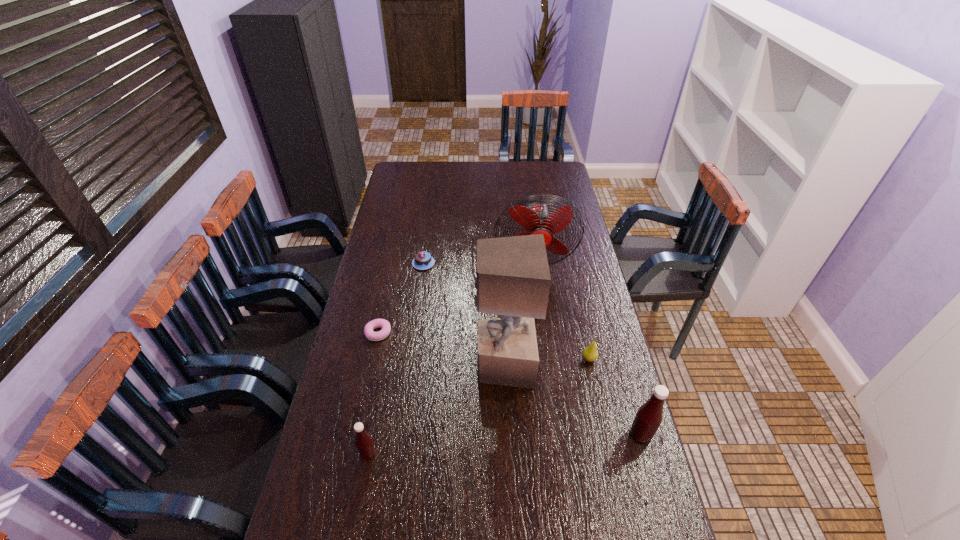
Image resolution: width=960 pixels, height=540 pixels. In order to click on vacant region between the pear and the sixth farthest object in this screenshot , I will do `click(615, 397)`.

The width and height of the screenshot is (960, 540). I want to click on free area in between the nearer Tabasco sauce and the fifth tallest object, so click(478, 407).

The image size is (960, 540). I want to click on free point between the nearer Tabasco sauce and the chocolate cake, so click(x=396, y=359).

The width and height of the screenshot is (960, 540). Identify the location of object that can be found as the third closest to the sixth farthest object. (536, 219).

Select which object is the sixth closest to the sixth farthest object. Please provide its 2D coordinates. Your answer should be formatted as a tuple, i.e. [(x, y)], where the tuple contains the x and y coordinates of a point satisfying the conditions above.

[(422, 260)]

Identify the location of vacant point that satisfies the following two spatial constraints: 1. on the front-facing side of the third tallest object; 2. on the right side of the tallest object. (507, 434).

This screenshot has width=960, height=540. Find the location of `free space that satisfies the following two spatial constraints: 1. on the back side of the third object from left to right; 2. on the right side of the nearest object`. free space that satisfies the following two spatial constraints: 1. on the back side of the third object from left to right; 2. on the right side of the nearest object is located at coordinates [404, 263].

The width and height of the screenshot is (960, 540). Find the location of `free location that satisfies the following two spatial constraints: 1. on the back side of the nearest object; 2. on the right side of the farther Tabasco sauce`. free location that satisfies the following two spatial constraints: 1. on the back side of the nearest object; 2. on the right side of the farther Tabasco sauce is located at coordinates (372, 434).

The width and height of the screenshot is (960, 540). Find the location of `vacant area that satisfies the following two spatial constraints: 1. on the front side of the fifth tallest object; 2. on the left side of the shortest object`. vacant area that satisfies the following two spatial constraints: 1. on the front side of the fifth tallest object; 2. on the left side of the shortest object is located at coordinates (372, 360).

I want to click on blank space that satisfies the following two spatial constraints: 1. on the front side of the third shortest object; 2. on the left side of the pastry, so click(x=372, y=360).